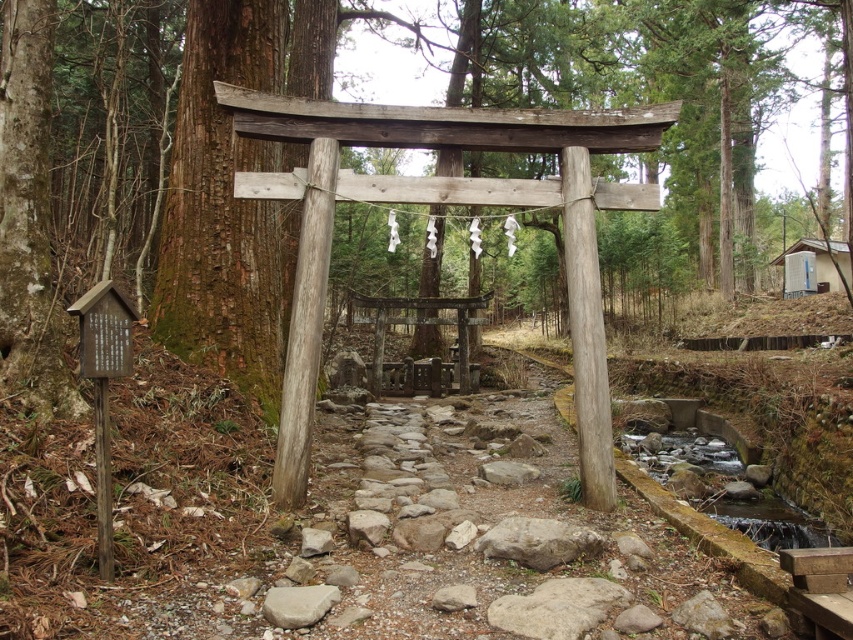
The height and width of the screenshot is (640, 853). What do you see at coordinates (538, 541) in the screenshot?
I see `gray rough rock at center` at bounding box center [538, 541].

Locate an element on the screen. This screenshot has height=640, width=853. gray rough rock at center is located at coordinates (538, 541).